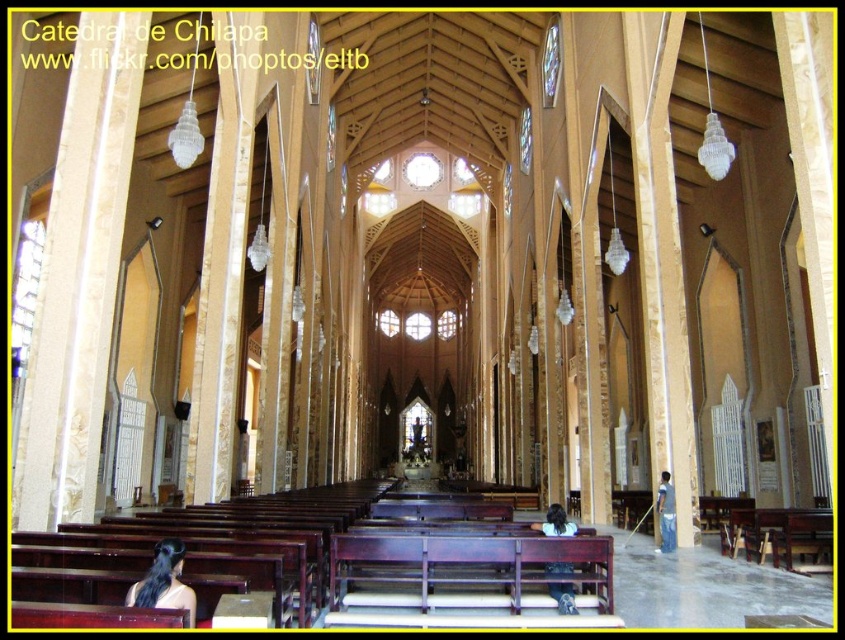
You are a visitor standing at the entrance of the Catedral de Chilapa. You notice a black hair at center and a light brown wooden bench at lower center. If you want to sit on the bench, how many steps would you need to take to reach it from where you are standing?

The black hair at center and light brown wooden bench at lower center are 41.44 feet apart from each other. Assuming an average step length of about 2.5 feet, you would need to take approximately 16 steps to reach the bench.

You are standing inside the Catedral de Chilapa and notice a small detail in the center of the cathedral. Based on the coordinates provided, can you determine the exact location of the black hair at center?

The black hair at center is located at the coordinates point (164,580).